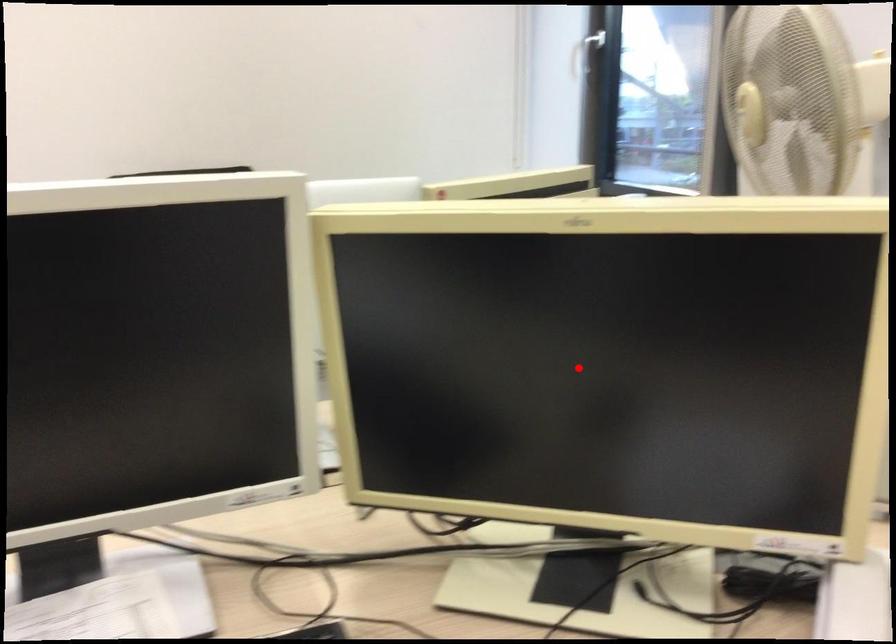
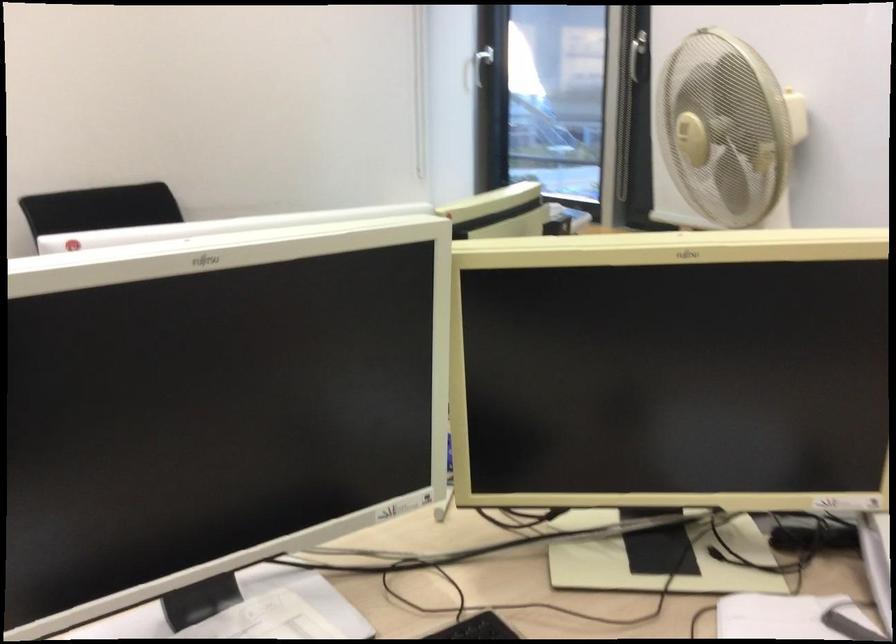
Question: I am providing you with two images of the same scene from different viewpoints. In image1, a red point is highlighted. Considering the same 3D point in image2, which of the following is correct?

Choices:
 (A) It is closer
 (B) It is farther

Answer: (B)